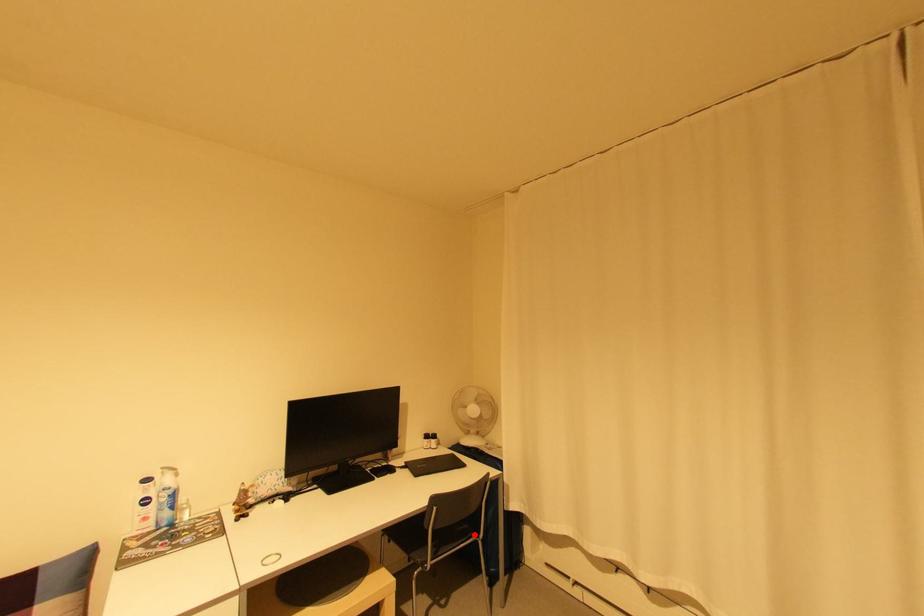
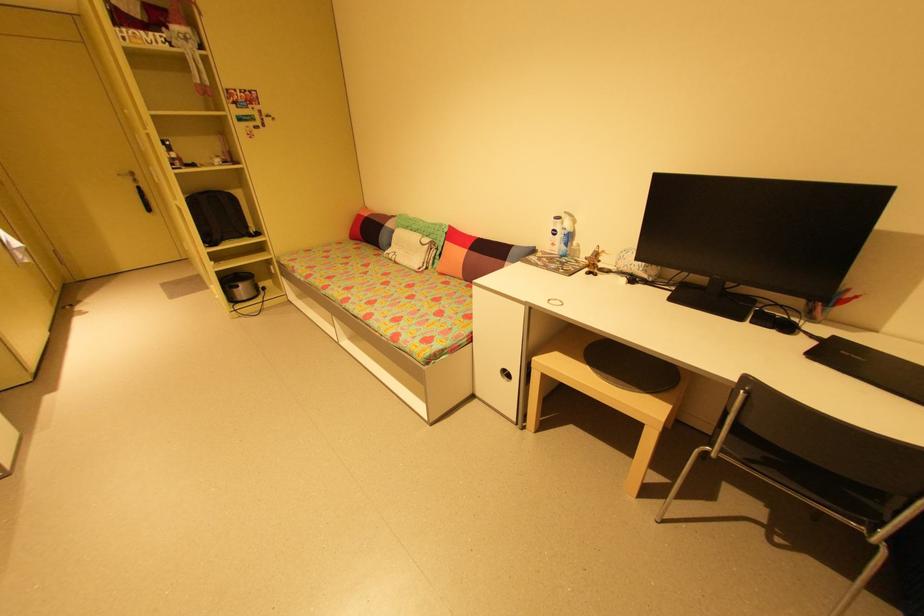
Where in the second image is the point corresponding to the highlighted location from the first image?

(869, 519)